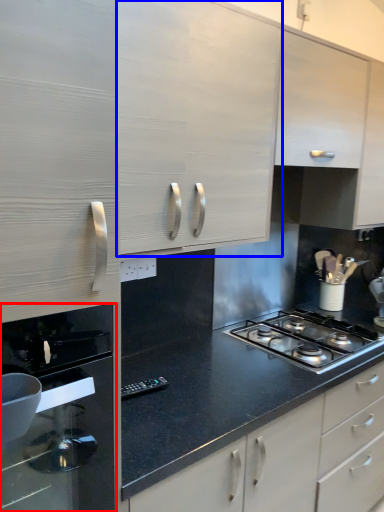
Question: Which object is further to the camera taking this photo, home appliance (highlighted by a red box) or cabinetry (highlighted by a blue box)?

Choices:
 (A) home appliance
 (B) cabinetry

Answer: (B)